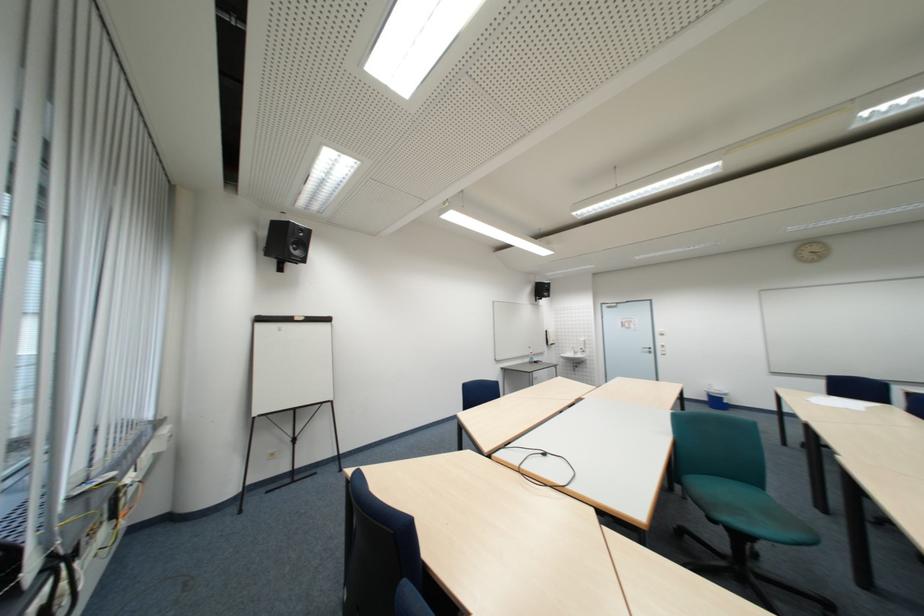
Where would you turn the silver door handle? Please return your answer as a coordinate pair (x, y).

(648, 349)